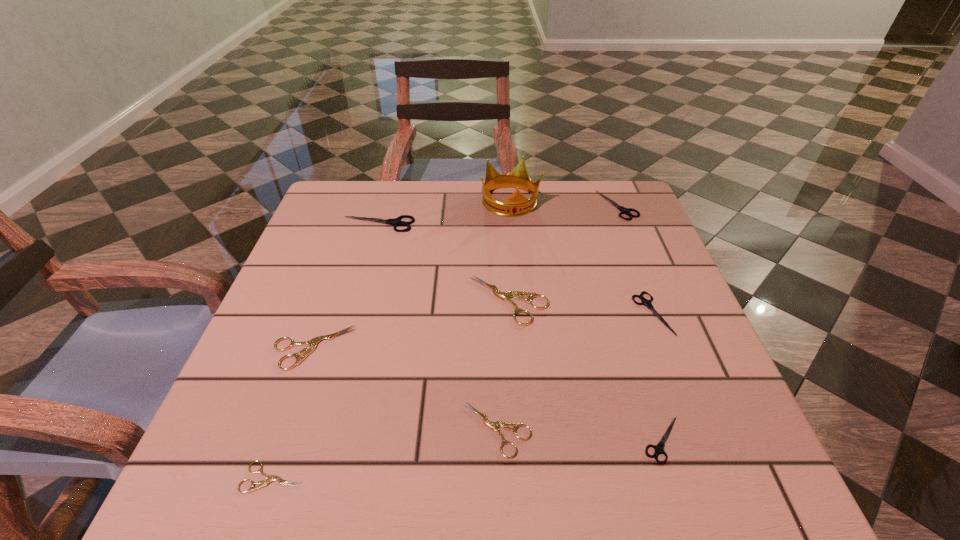
Image resolution: width=960 pixels, height=540 pixels. I want to click on free space that satisfies the following two spatial constraints: 1. on the back side of the biggest black shears; 2. on the right side of the second biggest black shears, so click(x=383, y=205).

At what (x,y) coordinates should I click in order to perform the action: click on free spot that satisfies the following two spatial constraints: 1. on the front side of the nearest black shears; 2. on the right side of the biggest black shears. Please return your answer as a coordinate pair (x, y). Looking at the image, I should click on (317, 440).